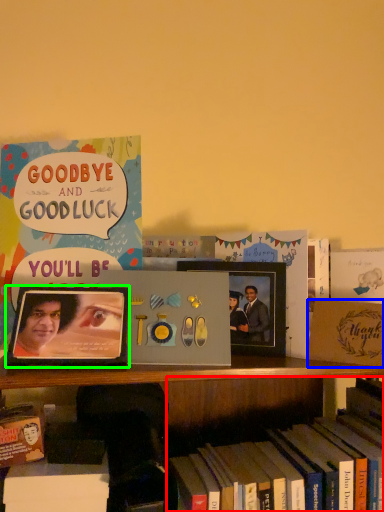
Question: Which is nearer to the book (highlighted by a red box)? paperback book (highlighted by a blue box) or picture frame (highlighted by a green box).

Choices:
 (A) paperback book
 (B) picture frame

Answer: (A)